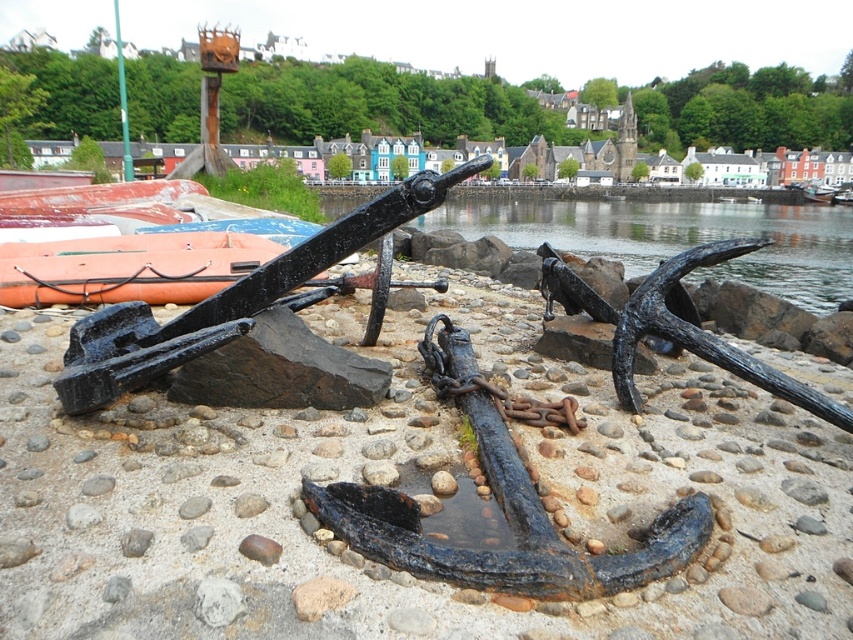
You are standing on the shore and want to compare the sizes of the objects you see. Which object is taller between the rusty metal anchor at center and the orange rubber boat at left?

The rusty metal anchor at center is taller than the orange rubber boat at left.

You are standing on the shore looking at the scene. A rusty metal anchor at center is located at point (409, 493). Where would you find the rusty metal anchor at center?

The rusty metal anchor at center is located at point (409, 493).